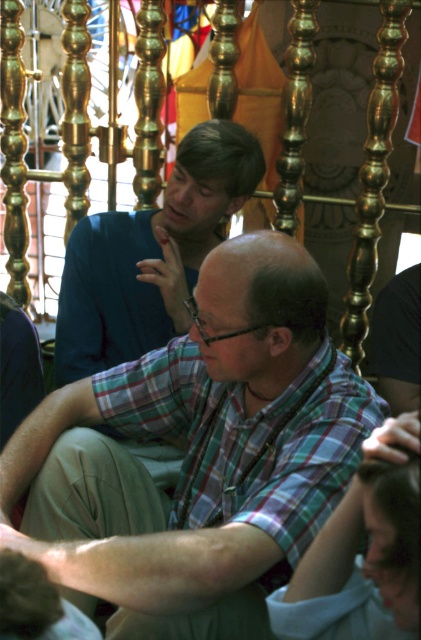
Question: Does plaid cotton shirt at center have a lesser width compared to plaid shirt at center?

Choices:
 (A) no
 (B) yes

Answer: (B)

Question: Does plaid cotton shirt at center appear on the left side of plaid shirt at center?

Choices:
 (A) yes
 (B) no

Answer: (B)

Question: From the image, what is the correct spatial relationship of plaid cotton shirt at center in relation to plaid shirt at center?

Choices:
 (A) left
 (B) right

Answer: (B)

Question: Which point is closer to the camera?

Choices:
 (A) plaid cotton shirt at center
 (B) plaid shirt at center

Answer: (A)